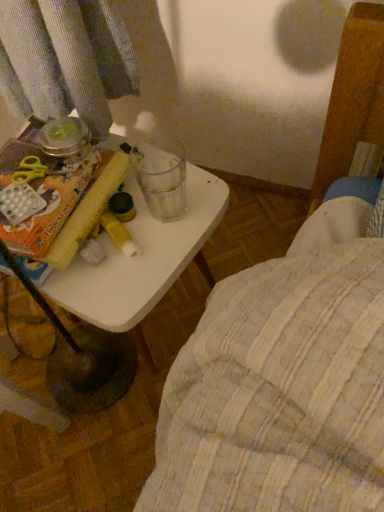
Where is `free space above white plastic table at center (from a real-world perspective)`? free space above white plastic table at center (from a real-world perspective) is located at coordinates (138, 227).